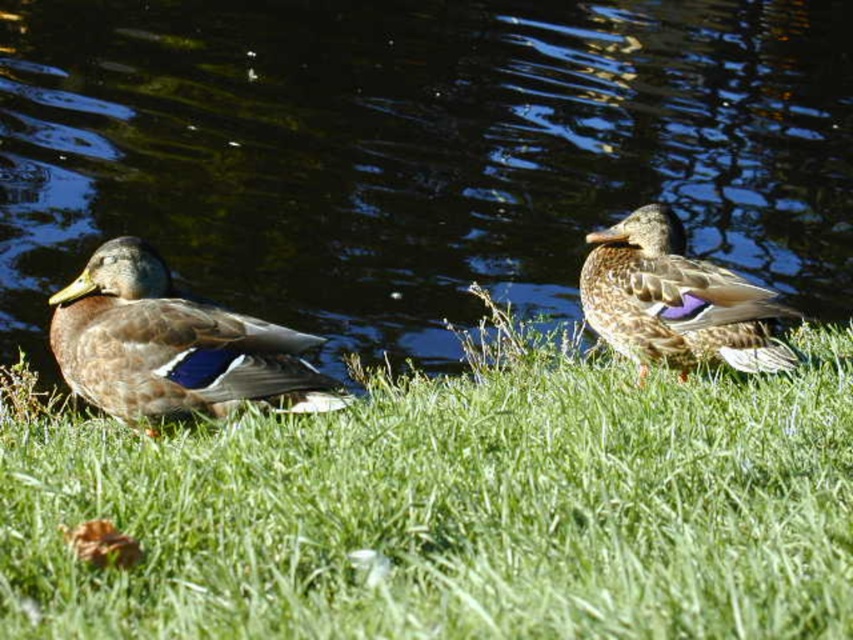
You are standing at the origin point of the coordinate system in the image. You see the brown matte duck at left represented by point (x=172, y=346). What is the coordinate of the brown matte duck at left?

The coordinate of the brown matte duck at left is point (x=172, y=346).

You are a photographer trying to capture a closeup of the brown matte duck at left while standing on the green grassy at lower center. Since you want to focus on the duck, will the grassy area be big enough to allow you to position yourself without stepping off it?

The green grassy at lower center is larger in size than brown matte duck at left, so yes, the grassy area is big enough to allow you to position yourself without needing to step off it.

You are a photographer aiming to capture both the brown matte duck at left and the brown feathered duck at center in a single shot. Based on their positions, which duck is closer to the camera?

The brown matte duck at left is in front of the brown feathered duck at center, so the brown matte duck at left is closer to the camera.